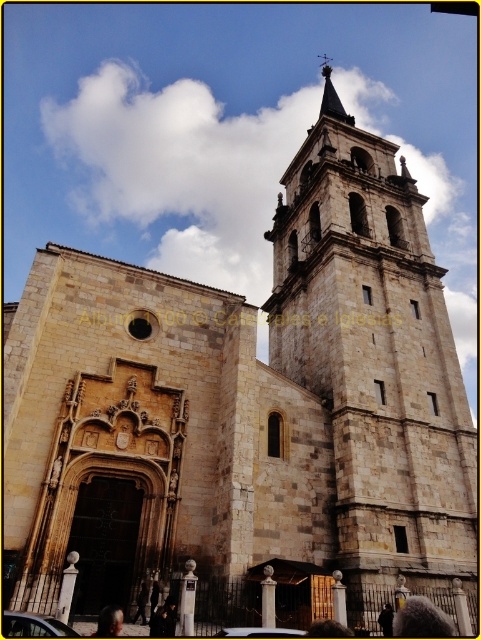
Question: Which object appears farthest from the camera in this image?

Choices:
 (A) stone tower at center
 (B) smooth gray stone spire at upper center

Answer: (B)

Question: Is stone tower at center thinner than smooth gray stone spire at upper center?

Choices:
 (A) yes
 (B) no

Answer: (B)

Question: Among these objects, which one is farthest from the camera?

Choices:
 (A) stone tower at center
 (B) smooth gray stone spire at upper center

Answer: (B)

Question: Is stone tower at center further to the viewer compared to smooth gray stone spire at upper center?

Choices:
 (A) no
 (B) yes

Answer: (A)

Question: Which point appears closest to the camera in this image?

Choices:
 (A) (331, 92)
 (B) (356, 396)

Answer: (B)

Question: Can you confirm if stone tower at center is smaller than smooth gray stone spire at upper center?

Choices:
 (A) yes
 (B) no

Answer: (A)